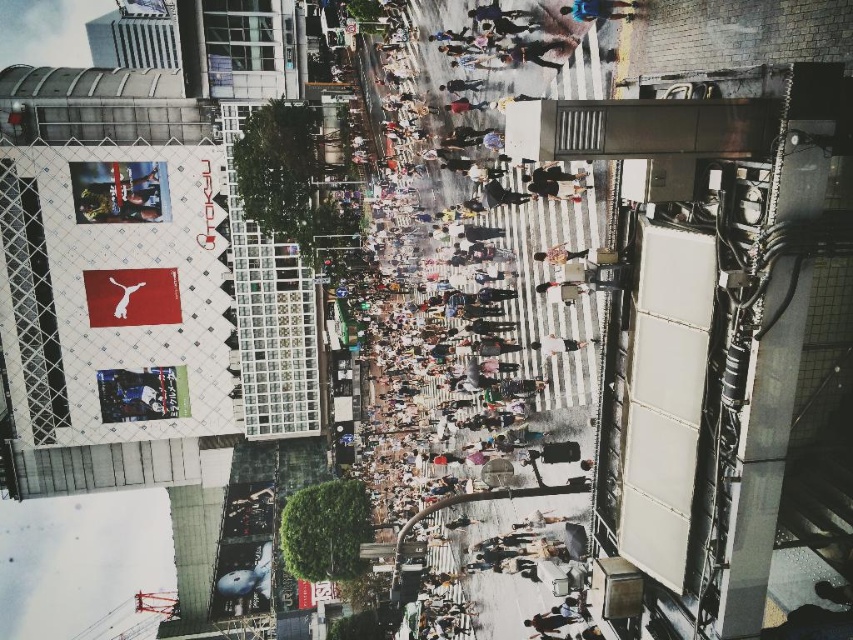
You are a photographer standing on a bridge and want to capture the human crowd at center and the light brown leather jacket at center in a single shot. Which object should you focus on first to ensure both are in frame?

The human crowd at center is much taller than the light brown leather jacket at center, so you should focus on the human crowd at center first to ensure both are in frame.

Looking at this image, you are a photographer trying to capture a clear shot of the light brown leather jacket at center in the urban scene. However, the human crowd at center is blocking your view. Can you determine if the jacket is still visible through the crowd?

The human crowd at center is positioned over light brown leather jacket at center, so the jacket is likely blocked and not visible through the crowd.

You are a photographer planning to capture a shot of the human crowd at center and the light brown leather bag at center in the urban scene. Based on the spatial relationship between them, which object would require a wider lens to include in the frame?

The human crowd at center might be wider than the light brown leather bag at center, so a wider lens would be needed to capture the human crowd at center properly.